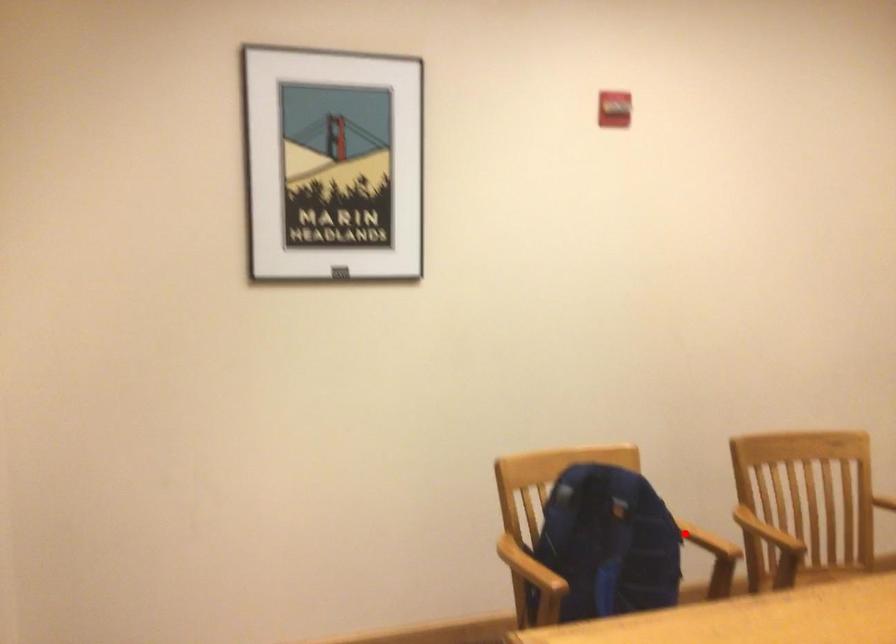
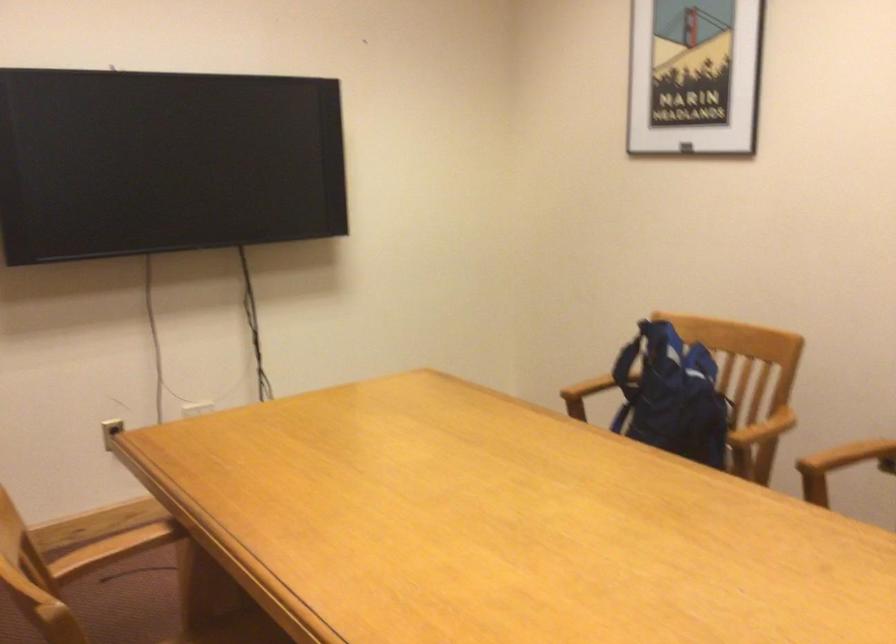
Locate, in the second image, the point that corresponds to the highlighted location in the first image.

(763, 428)